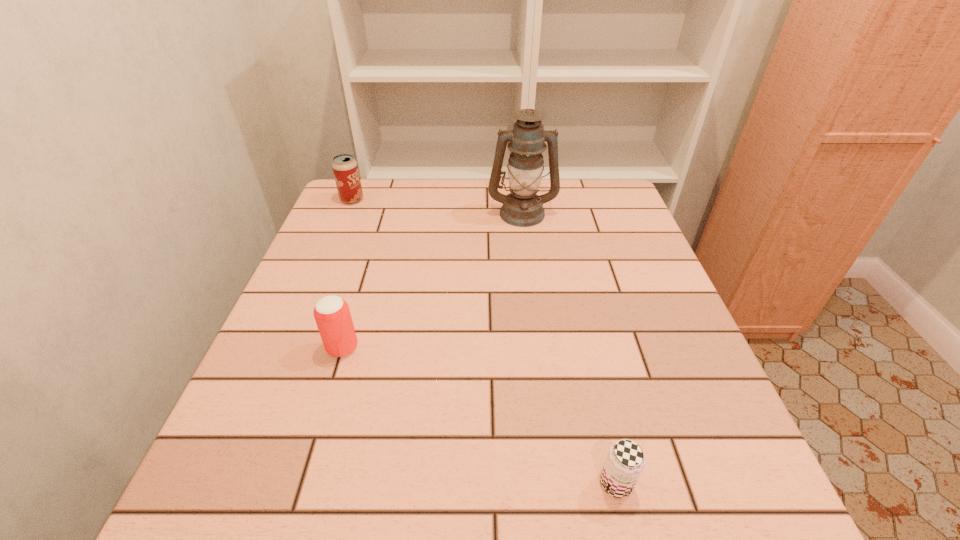
I want to click on vacant position at the far right corner of the desktop, so click(588, 184).

Where is `free space at the near right corner`? The image size is (960, 540). free space at the near right corner is located at coordinates (668, 523).

Locate an element on the screen. Image resolution: width=960 pixels, height=540 pixels. free space that is in between the oil lamp and the nearest object is located at coordinates (569, 348).

What are the coordinates of `free spot between the tallest object and the shortest beer can` in the screenshot? It's located at (569, 348).

Find the location of a particular element. Image resolution: width=960 pixels, height=540 pixels. free space between the second beer can from left to right and the leftmost beer can is located at coordinates (348, 274).

Find the location of a particular element. blank region between the second beer can from right to left and the tallest object is located at coordinates (432, 280).

Identify the location of free space that is in between the leftmost beer can and the tallest object. The image size is (960, 540). (437, 206).

This screenshot has height=540, width=960. What are the coordinates of `empty location between the nearest object and the third farthest object` in the screenshot? It's located at (479, 416).

I want to click on free space between the oil lamp and the farthest beer can, so click(437, 206).

You are a GUI agent. You are given a task and a screenshot of the screen. Output one action in this format:
    pyautogui.click(x=<x>, y=<y>)
    Task: Click on the free space between the shortest object and the second nearest object
    
    Given the screenshot: What is the action you would take?
    pyautogui.click(x=479, y=416)